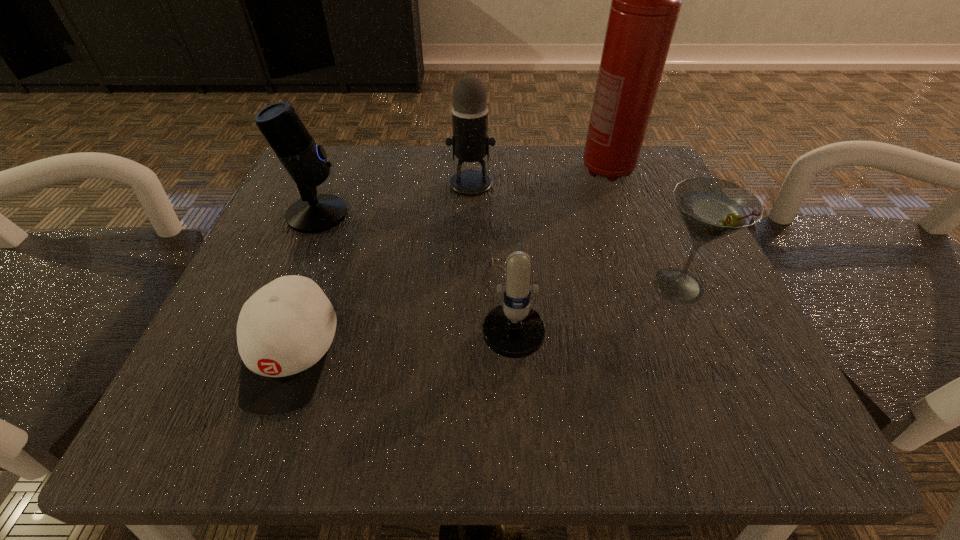
Locate an element on the screen. This screenshot has height=540, width=960. empty location between the baseball cap and the farthest microphone is located at coordinates (381, 269).

You are a GUI agent. You are given a task and a screenshot of the screen. Output one action in this format:
    pyautogui.click(x=<x>, y=<y>)
    Task: Click on the empty space between the leftmost microphone and the farthest microphone
    
    Given the screenshot: What is the action you would take?
    pyautogui.click(x=395, y=199)

Where is `free space between the second shortest object and the shortest object`? The width and height of the screenshot is (960, 540). free space between the second shortest object and the shortest object is located at coordinates (400, 331).

Locate an element on the screen. empty location between the fourth nearest object and the farthest microphone is located at coordinates (395, 199).

The width and height of the screenshot is (960, 540). I want to click on object that is the closest to the martini, so click(514, 330).

You are a GUI agent. You are given a task and a screenshot of the screen. Output one action in this format:
    pyautogui.click(x=<x>, y=<y>)
    Task: Click on the second closest object to the nearest microphone
    This screenshot has height=540, width=960.
    Given the screenshot: What is the action you would take?
    pyautogui.click(x=470, y=142)

Find the location of a particular element. The width and height of the screenshot is (960, 540). microphone that is the second closest to the farthest microphone is located at coordinates (305, 161).

Locate which microphone ranks second in proximity to the leftmost microphone. Please provide its 2D coordinates. Your answer should be formatted as a tuple, i.e. [(x, y)], where the tuple contains the x and y coordinates of a point satisfying the conditions above.

[(514, 330)]

You are a GUI agent. You are given a task and a screenshot of the screen. Output one action in this format:
    pyautogui.click(x=<x>, y=<y>)
    Task: Click on the free space that satisfies the following two spatial constraints: 1. on the back side of the martini; 2. on the stand of the fourth nearest object
    Image resolution: width=960 pixels, height=540 pixels.
    Given the screenshot: What is the action you would take?
    pyautogui.click(x=648, y=214)

Find the location of a particular element. This screenshot has height=540, width=960. free location that satisfies the following two spatial constraints: 1. on the handle side the tallest object; 2. on the stand of the second farthest microphone is located at coordinates (623, 214).